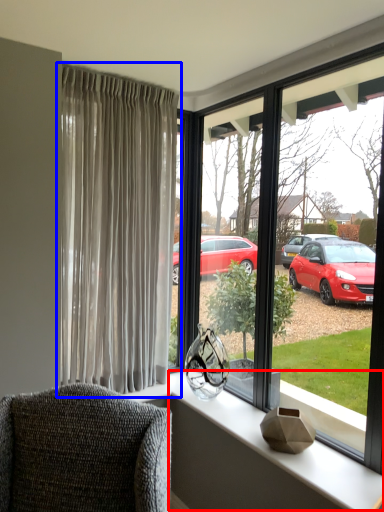
Question: Among these objects, which one is nearest to the camera, window sill (highlighted by a red box) or curtain (highlighted by a blue box)?

Choices:
 (A) window sill
 (B) curtain

Answer: (A)